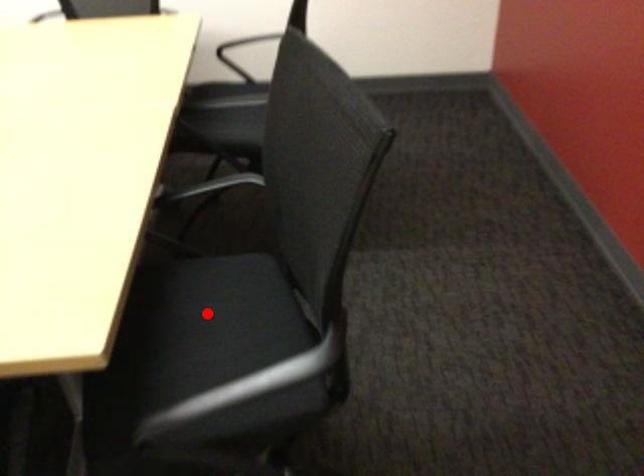
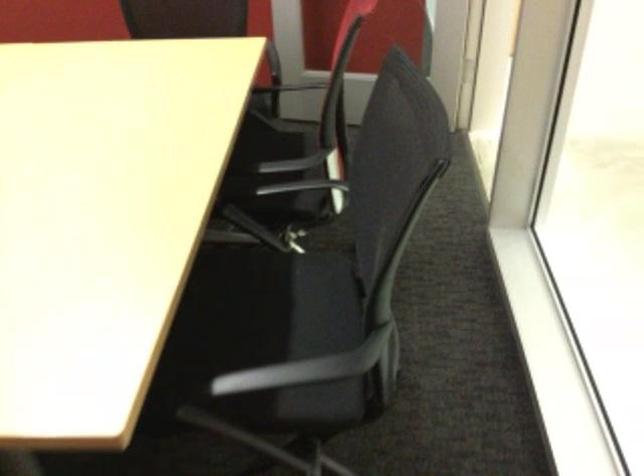
Question: I am providing you with two images of the same scene from different viewpoints. A red point is marked on the first image. At the location where the point appears in image 1, is it still visible in image 2?

Choices:
 (A) Yes
 (B) No

Answer: (B)